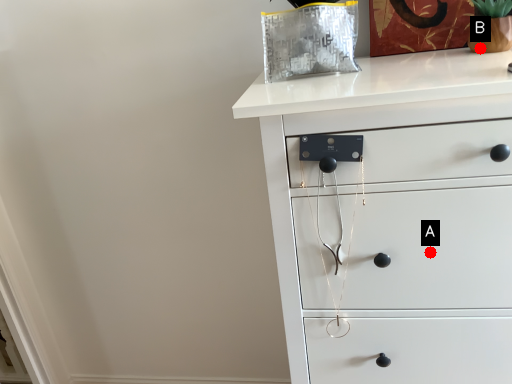
Question: Two points are circled on the image, labeled by A and B beside each circle. Which point appears farthest from the camera in this image?

Choices:
 (A) A is further
 (B) B is further

Answer: (B)